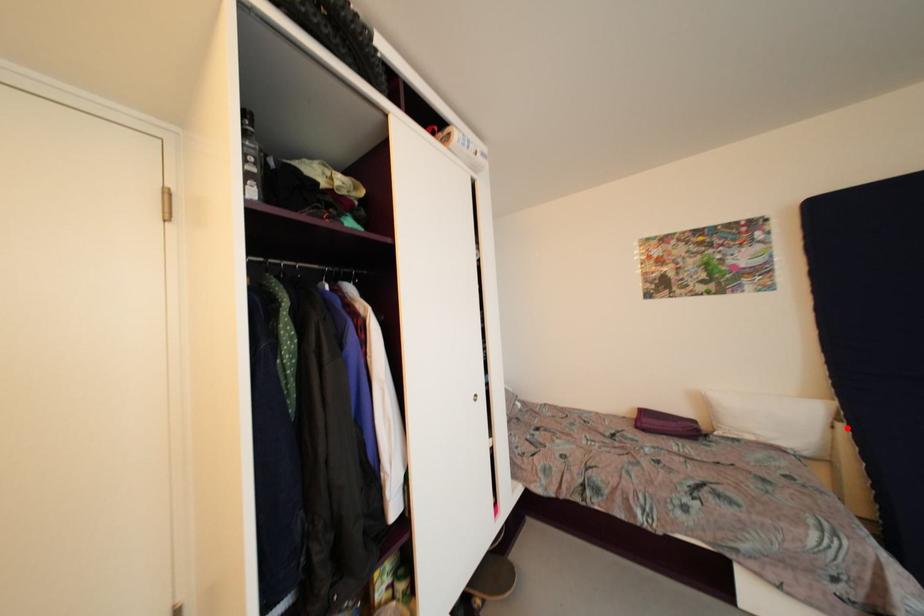
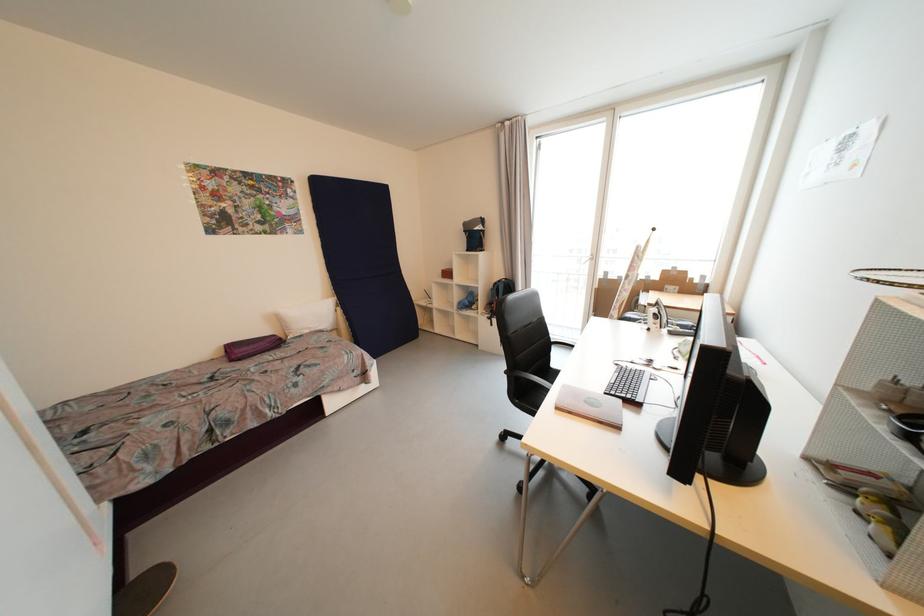
The point at the highlighted location is marked in the first image. Where is the corresponding point in the second image?

(344, 310)